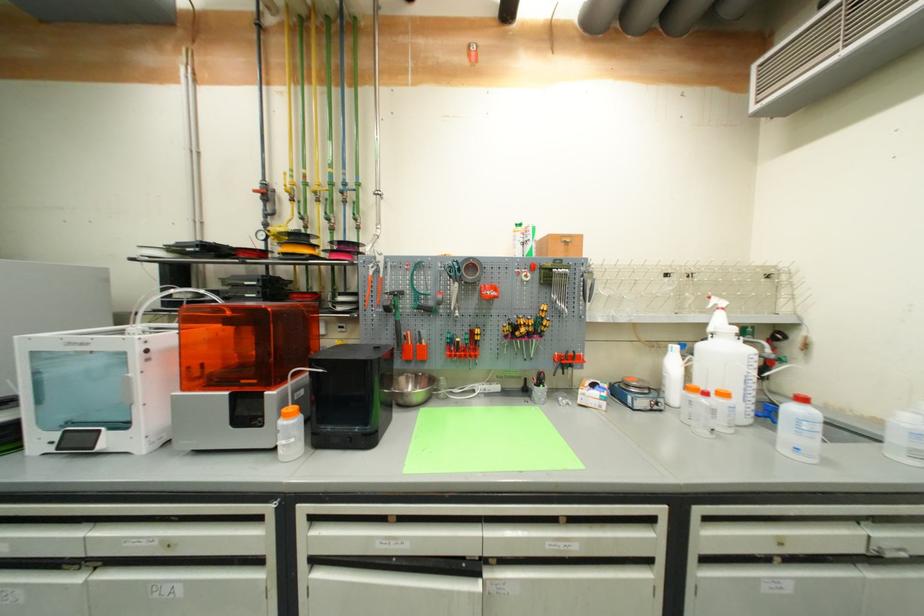
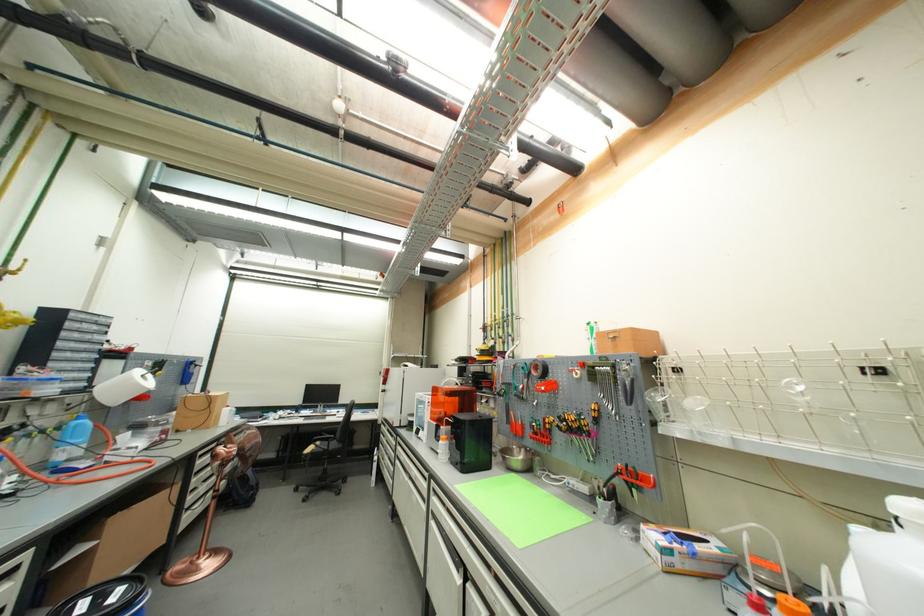
In the second image, find the point that corresponds to point 602,408 in the first image.

(661, 561)